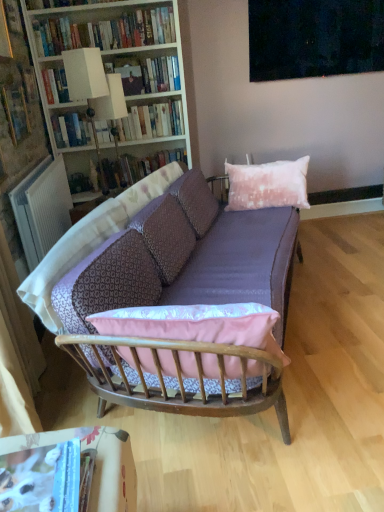
Question: Should I look upward or downward to see dark matte painting at upper center?

Choices:
 (A) up
 (B) down

Answer: (A)

Question: Does hardcover book at upper center, the 2th book in the top-to-bottom sequence, come in front of hardcover books at upper left, arranged as the 4th book when viewed from the back?

Choices:
 (A) no
 (B) yes

Answer: (A)

Question: Is hardcover book at upper center, placed as the fourth book when sorted from front to back, beside hardcover books at upper left, arranged as the 6th book when ordered from the bottom?

Choices:
 (A) no
 (B) yes

Answer: (A)

Question: Is hardcover book at upper center, placed as the fourth book when sorted from front to back, positioned behind hardcover books at upper left, arranged as the 6th book when ordered from the bottom?

Choices:
 (A) yes
 (B) no

Answer: (A)

Question: Considering the relative sizes of hardcover book at upper center, arranged as the fifth book when ordered from the bottom, and hardcover books at upper left, arranged as the third book when viewed from the front, in the image provided, is hardcover book at upper center, arranged as the fifth book when ordered from the bottom, wider than hardcover books at upper left, arranged as the third book when viewed from the front,?

Choices:
 (A) no
 (B) yes

Answer: (B)

Question: Is hardcover book at upper center, placed as the fourth book when sorted from front to back, to the right of hardcover books at upper left, which appears as the first book when viewed from the top, from the viewer's perspective?

Choices:
 (A) no
 (B) yes

Answer: (B)

Question: Is hardcover book at upper center, placed as the fourth book when sorted from front to back, surrounding hardcover books at upper left, arranged as the 6th book when ordered from the bottom?

Choices:
 (A) no
 (B) yes

Answer: (A)

Question: Is hardcover book at upper center, arranged as the fifth book when ordered from the bottom, to the right of hardcover book at upper left, acting as the fifth book starting from the back, from the viewer's perspective?

Choices:
 (A) no
 (B) yes

Answer: (B)

Question: Is hardcover book at upper center, the 2th book in the top-to-bottom sequence, looking in the opposite direction of hardcover book at upper left, acting as the fifth book starting from the back?

Choices:
 (A) no
 (B) yes

Answer: (A)

Question: Can you confirm if hardcover book at upper center, arranged as the fifth book when ordered from the bottom, is taller than hardcover book at upper left, positioned as the 4th book in top-to-bottom order?

Choices:
 (A) no
 (B) yes

Answer: (A)

Question: Can you confirm if hardcover book at upper center, arranged as the fifth book when ordered from the bottom, is shorter than hardcover book at upper left, which ranks as the third book in bottom-to-top order?

Choices:
 (A) no
 (B) yes

Answer: (B)

Question: Is hardcover book at upper center, placed as the fourth book when sorted from front to back, wider than hardcover book at upper left, positioned as the 4th book in top-to-bottom order?

Choices:
 (A) no
 (B) yes

Answer: (B)

Question: From the image's perspective, is hardcover book at upper center, placed as the fourth book when sorted from front to back, over hardcover book at upper left, the second book when ordered from front to back?

Choices:
 (A) no
 (B) yes

Answer: (B)

Question: From a real-world perspective, is white plastic radiator at left physically above hardcover book at center, positioned as the fifth book in top-to-bottom order?

Choices:
 (A) yes
 (B) no

Answer: (A)